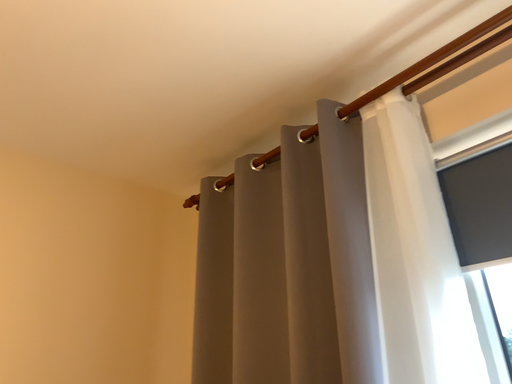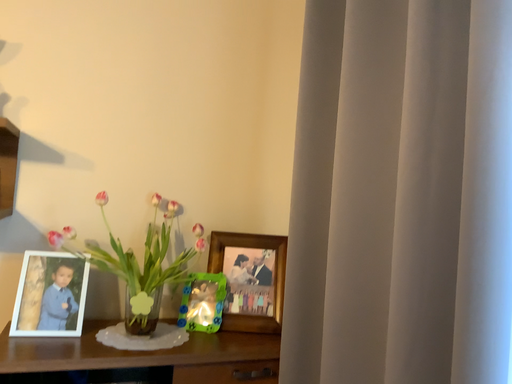
Question: Which way did the camera rotate in the video?

Choices:
 (A) rotated right
 (B) rotated left

Answer: (B)